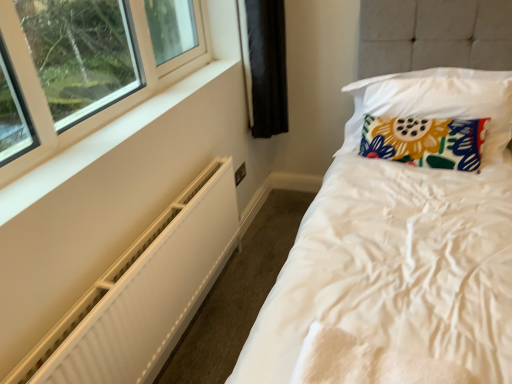
The width and height of the screenshot is (512, 384). Describe the element at coordinates (420, 97) in the screenshot. I see `floral fabric pillow at upper right, which ranks as the second pillow in bottom-to-top order` at that location.

Measure the distance between point (218, 244) and camera.

Point (218, 244) and camera are 6.80 feet apart from each other.

The image size is (512, 384). I want to click on floral fabric pillow at upper right, which ranks as the second pillow in bottom-to-top order, so click(420, 97).

Is floral fabric pillow at upper right, which is the first pillow from top to bottom, directly adjacent to white textured radiator at lower left?

No.

Which of these two, floral fabric pillow at upper right, which is the first pillow from top to bottom, or white textured radiator at lower left, stands taller?

With more height is white textured radiator at lower left.

Find the location of a particular element. The width and height of the screenshot is (512, 384). pillow that is the 2nd one when counting rightward from the white textured radiator at lower left is located at coordinates (420, 97).

Would you say floral fabric pillow at upper right, which ranks as the second pillow in bottom-to-top order, is a long distance from floral fabric pillow at upper right, arranged as the first pillow when ordered from the bottom?

No, floral fabric pillow at upper right, which ranks as the second pillow in bottom-to-top order, is not far away from floral fabric pillow at upper right, arranged as the first pillow when ordered from the bottom.

Which object is closer to the camera taking this photo, floral fabric pillow at upper right, which ranks as the second pillow in bottom-to-top order, or floral fabric pillow at upper right, the 2th pillow positioned from the top?

floral fabric pillow at upper right, which ranks as the second pillow in bottom-to-top order, is closer to the camera.

Could you tell me if floral fabric pillow at upper right, which is the first pillow from top to bottom, is turned towards floral fabric pillow at upper right, the 2th pillow positioned from the top?

Yes, floral fabric pillow at upper right, which is the first pillow from top to bottom, faces towards floral fabric pillow at upper right, the 2th pillow positioned from the top.

Does floral fabric pillow at upper right, arranged as the first pillow when ordered from the bottom, turn towards floral fabric pillow at upper right, which is the first pillow from top to bottom?

Yes, floral fabric pillow at upper right, arranged as the first pillow when ordered from the bottom, is facing floral fabric pillow at upper right, which is the first pillow from top to bottom.

Between floral fabric pillow at upper right, the 2th pillow positioned from the top, and floral fabric pillow at upper right, which is the first pillow from top to bottom, which one has larger size?

With larger size is floral fabric pillow at upper right, which is the first pillow from top to bottom.

Is there a large distance between floral fabric pillow at upper right, arranged as the first pillow when ordered from the bottom, and floral fabric pillow at upper right, which is the first pillow from top to bottom?

floral fabric pillow at upper right, arranged as the first pillow when ordered from the bottom, is actually quite close to floral fabric pillow at upper right, which is the first pillow from top to bottom.

Where is `radiator on the left of floral fabric pillow at upper right, arranged as the first pillow when ordered from the bottom`? radiator on the left of floral fabric pillow at upper right, arranged as the first pillow when ordered from the bottom is located at coordinates (142, 292).

Who is shorter, white textured radiator at lower left or floral fabric pillow at upper right, arranged as the first pillow when ordered from the bottom?

With less height is floral fabric pillow at upper right, arranged as the first pillow when ordered from the bottom.

Is there a large distance between white textured radiator at lower left and floral fabric pillow at upper right, arranged as the first pillow when ordered from the bottom?

Yes, white textured radiator at lower left is far from floral fabric pillow at upper right, arranged as the first pillow when ordered from the bottom.

Is floral fabric pillow at upper right, which ranks as the second pillow in bottom-to-top order, surrounded by white textured radiator at lower left?

That's incorrect, floral fabric pillow at upper right, which ranks as the second pillow in bottom-to-top order, is not inside white textured radiator at lower left.

How many degrees apart are the facing directions of white textured radiator at lower left and floral fabric pillow at upper right, which is the first pillow from top to bottom?

The angle between the facing direction of white textured radiator at lower left and the facing direction of floral fabric pillow at upper right, which is the first pillow from top to bottom, is 91.4 degrees.

Based on the photo, considering the sizes of objects white textured radiator at lower left and floral fabric pillow at upper right, which is the first pillow from top to bottom, in the image provided, who is shorter, white textured radiator at lower left or floral fabric pillow at upper right, which is the first pillow from top to bottom,?

floral fabric pillow at upper right, which is the first pillow from top to bottom.

Locate an element on the screen. Image resolution: width=512 pixels, height=384 pixels. radiator in front of the floral fabric pillow at upper right, which ranks as the second pillow in bottom-to-top order is located at coordinates (142, 292).

Which of these two, floral fabric pillow at upper right, arranged as the first pillow when ordered from the bottom, or white textured radiator at lower left, is wider?

With larger width is floral fabric pillow at upper right, arranged as the first pillow when ordered from the bottom.

Which object is positioned more to the left, floral fabric pillow at upper right, the 2th pillow positioned from the top, or white textured radiator at lower left?

From the viewer's perspective, white textured radiator at lower left appears more on the left side.

Does point (429, 134) come closer to viewer compared to point (178, 199)?

No, it is behind (178, 199).

You are a GUI agent. You are given a task and a screenshot of the screen. Output one action in this format:
    pyautogui.click(x=<x>, y=<y>)
    Task: Click on the 2nd pillow to the right of the white textured radiator at lower left, counting from the anchor's position
    The height and width of the screenshot is (384, 512).
    Given the screenshot: What is the action you would take?
    pyautogui.click(x=420, y=97)

Where is `pillow that is behind the floral fabric pillow at upper right, which is the first pillow from top to bottom`? pillow that is behind the floral fabric pillow at upper right, which is the first pillow from top to bottom is located at coordinates [425, 141].

Looking at the image, which one is located closer to floral fabric pillow at upper right, arranged as the first pillow when ordered from the bottom, floral fabric pillow at upper right, which ranks as the second pillow in bottom-to-top order, or white textured radiator at lower left?

floral fabric pillow at upper right, which ranks as the second pillow in bottom-to-top order.

Based on their spatial positions, is floral fabric pillow at upper right, arranged as the first pillow when ordered from the bottom, or white textured radiator at lower left closer to floral fabric pillow at upper right, which ranks as the second pillow in bottom-to-top order?

floral fabric pillow at upper right, arranged as the first pillow when ordered from the bottom, lies closer to floral fabric pillow at upper right, which ranks as the second pillow in bottom-to-top order, than the other object.

When comparing their distances from white textured radiator at lower left, does floral fabric pillow at upper right, which ranks as the second pillow in bottom-to-top order, or floral fabric pillow at upper right, arranged as the first pillow when ordered from the bottom, seem closer?

floral fabric pillow at upper right, arranged as the first pillow when ordered from the bottom.

Considering their positions, is white textured radiator at lower left positioned further to floral fabric pillow at upper right, which is the first pillow from top to bottom, than floral fabric pillow at upper right, the 2th pillow positioned from the top?

The object further to floral fabric pillow at upper right, which is the first pillow from top to bottom, is white textured radiator at lower left.

Looking at the image, which one is located closer to white textured radiator at lower left, floral fabric pillow at upper right, the 2th pillow positioned from the top, or floral fabric pillow at upper right, which is the first pillow from top to bottom?

floral fabric pillow at upper right, the 2th pillow positioned from the top, is closer to white textured radiator at lower left.

Considering their positions, is white textured radiator at lower left positioned closer to floral fabric pillow at upper right, arranged as the first pillow when ordered from the bottom, than floral fabric pillow at upper right, which is the first pillow from top to bottom?

floral fabric pillow at upper right, which is the first pillow from top to bottom, lies closer to floral fabric pillow at upper right, arranged as the first pillow when ordered from the bottom, than the other object.

Image resolution: width=512 pixels, height=384 pixels. What are the coordinates of `pillow between white textured radiator at lower left and floral fabric pillow at upper right, which is the first pillow from top to bottom, from left to right` in the screenshot? It's located at (425, 141).